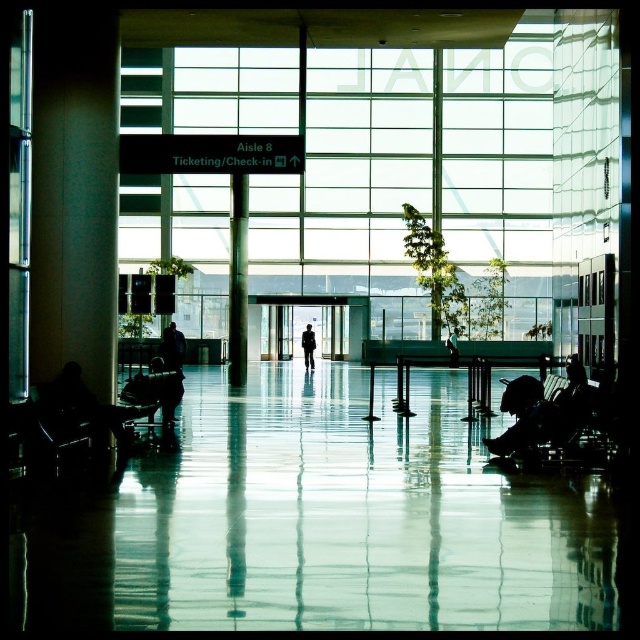
Question: Which object appears farthest from the camera in this image?

Choices:
 (A) dark blue jacket at center
 (B) silhouette figure at left
 (C) black suit at center

Answer: (C)

Question: Which point is farther to the camera?

Choices:
 (A) dark blue jacket at center
 (B) metallic column at center

Answer: (A)

Question: Is metallic column at center to the left of light brown leather jacket at center from the viewer's perspective?

Choices:
 (A) yes
 (B) no

Answer: (A)

Question: Is silhouette fabric at lower right bigger than silhouette figure at left?

Choices:
 (A) no
 (B) yes

Answer: (B)

Question: Which object is positioned closest to the black suit at center?

Choices:
 (A) metallic column at center
 (B) silhouette figure at left
 (C) dark blue jacket at center

Answer: (A)

Question: Does silhouette figure at left come in front of light brown leather jacket at center?

Choices:
 (A) no
 (B) yes

Answer: (B)